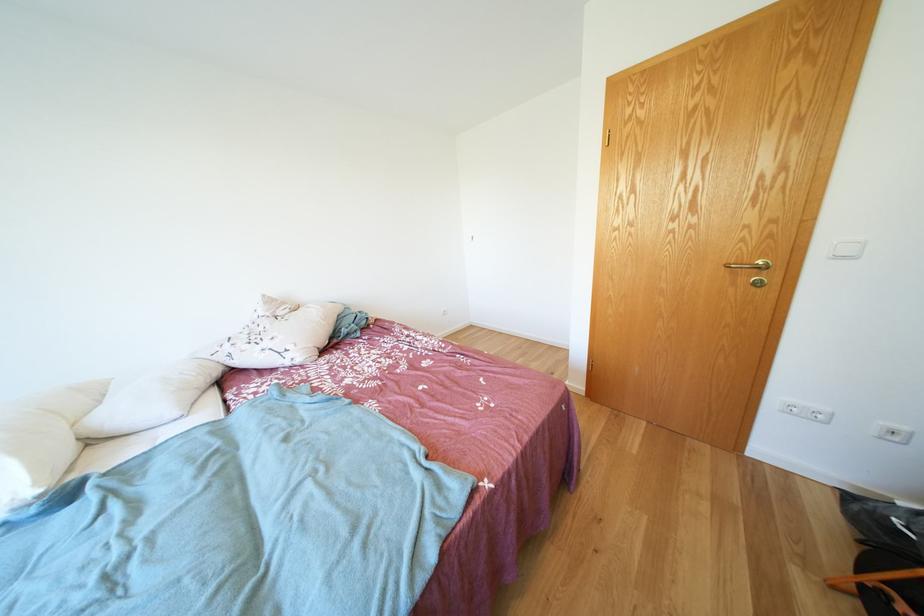
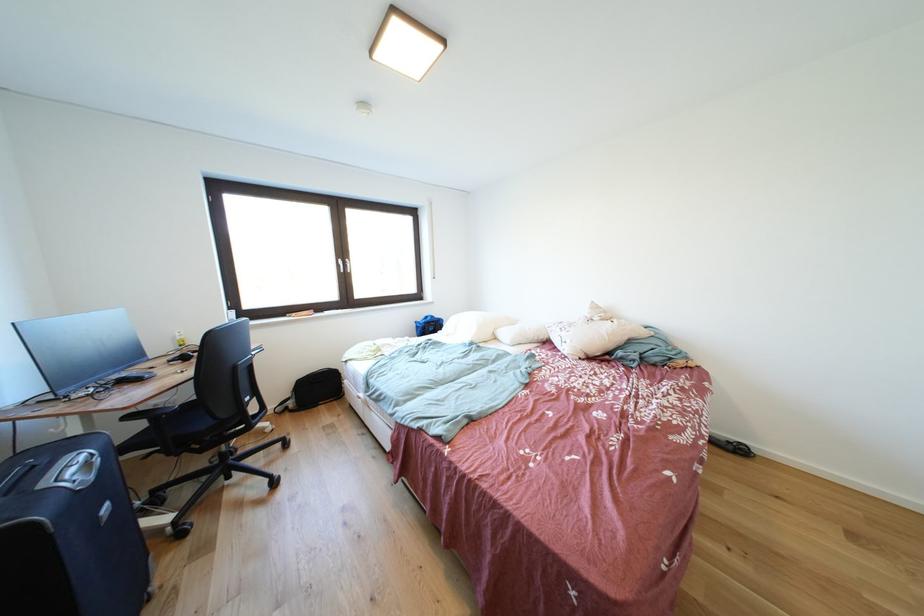
Where in the second image is the point corresponding to (x=274, y=349) from the first image?

(572, 338)